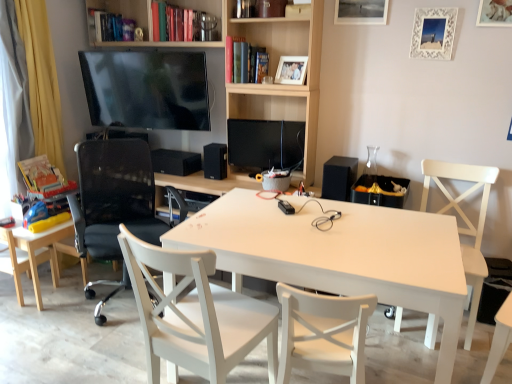
Where is `free space in front of black mesh office chair at left, which is the 2th chair in left-to-right order`? free space in front of black mesh office chair at left, which is the 2th chair in left-to-right order is located at coordinates (81, 351).